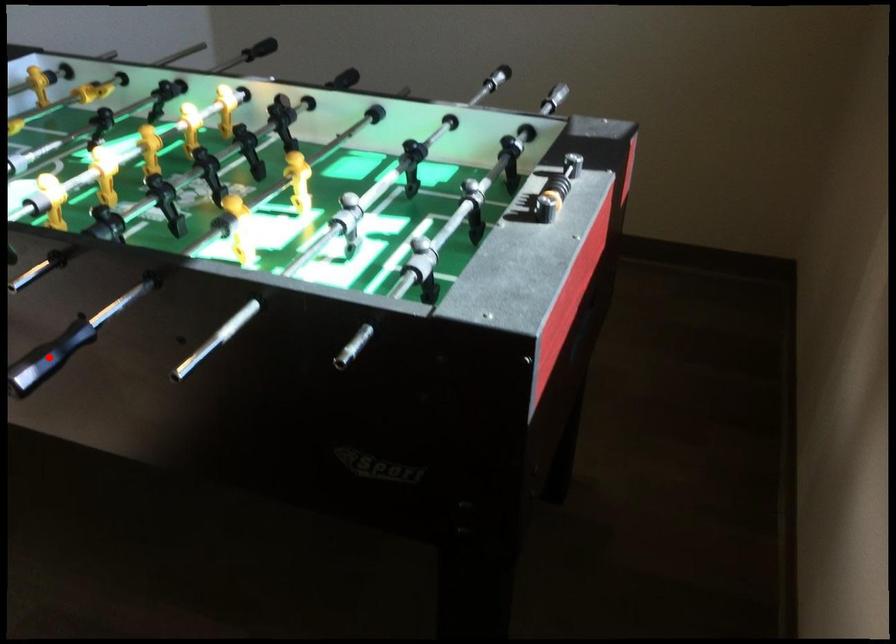
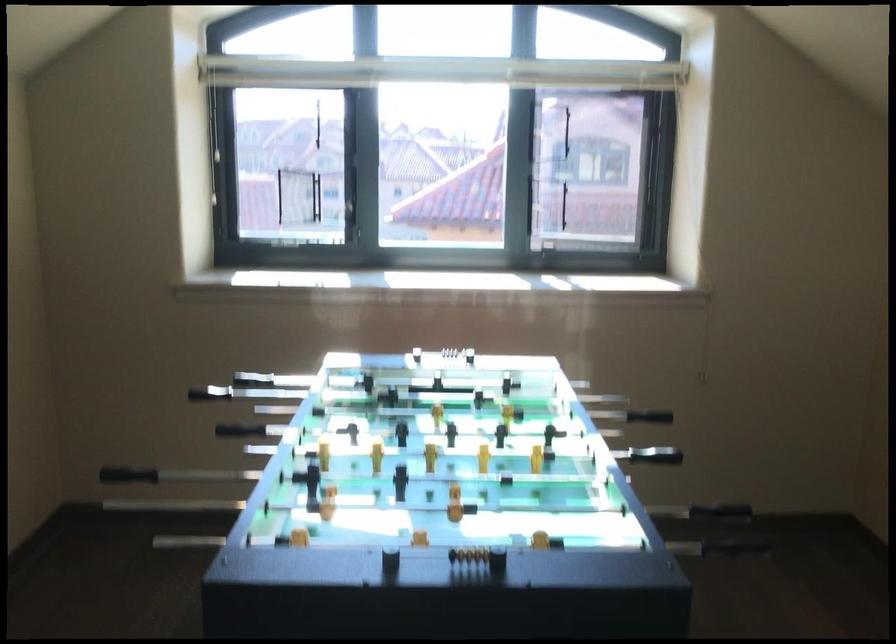
The point at the highlighted location is marked in the first image. Where is the corresponding point in the second image?

(645, 424)